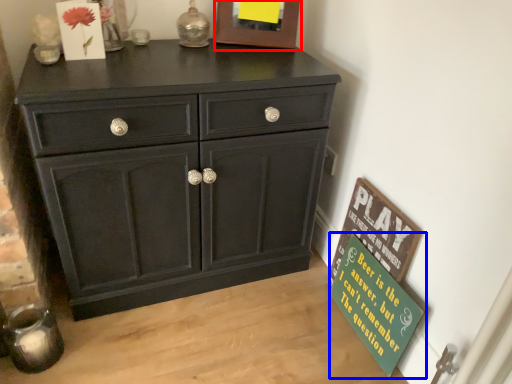
Question: Which object appears farthest to the camera in this image, picture frame (highlighted by a red box) or bulletin board (highlighted by a blue box)?

Choices:
 (A) picture frame
 (B) bulletin board

Answer: (A)